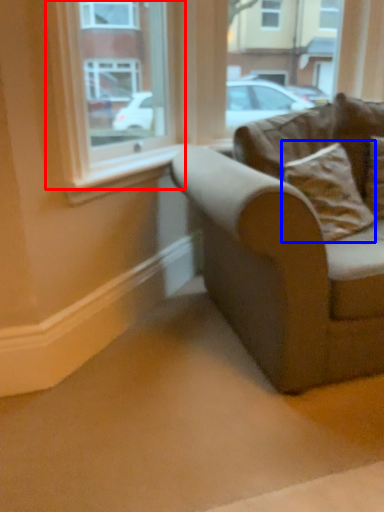
Question: Which object is further to the camera taking this photo, window (highlighted by a red box) or pillow (highlighted by a blue box)?

Choices:
 (A) window
 (B) pillow

Answer: (B)